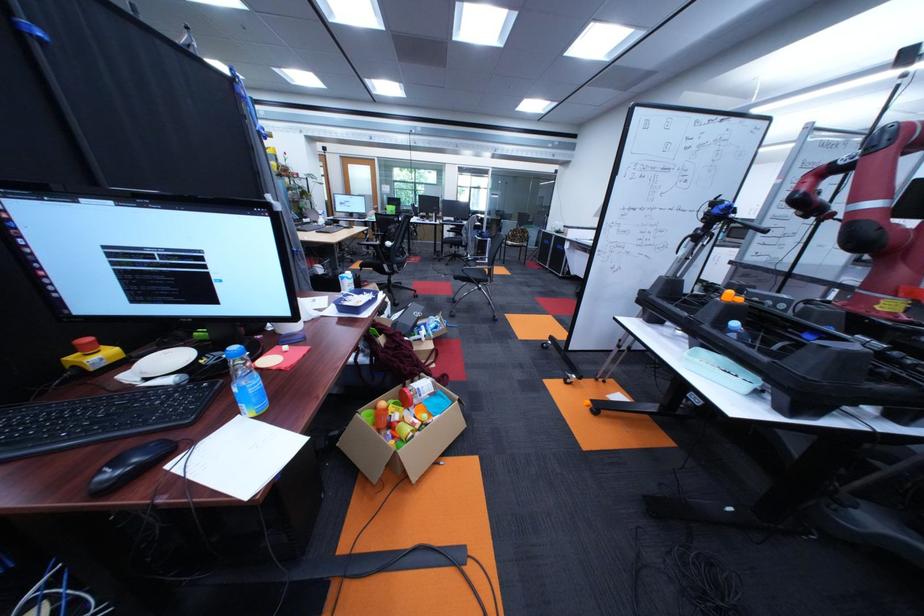
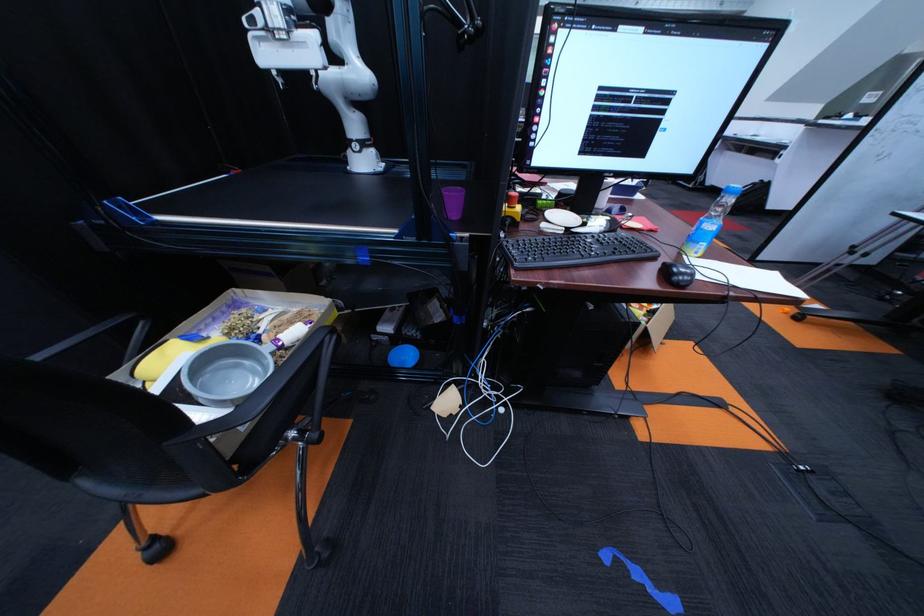
The point at (190,386) is marked in the first image. Where is the corresponding point in the second image?

(614, 233)